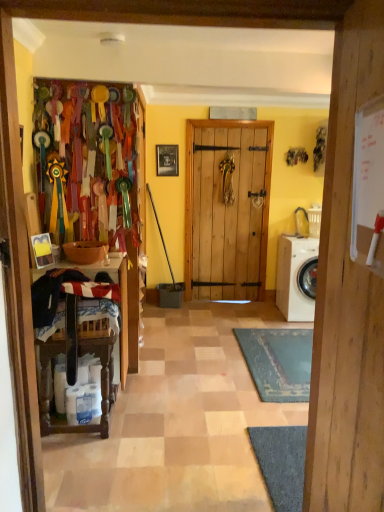
Question: From the image's perspective, would you say wooden door at center is shown under wooden frame at center?

Choices:
 (A) yes
 (B) no

Answer: (A)

Question: From a real-world perspective, is wooden door at center located higher than wooden frame at center?

Choices:
 (A) no
 (B) yes

Answer: (A)

Question: Is wooden frame at center surrounded by wooden door at center?

Choices:
 (A) no
 (B) yes

Answer: (A)

Question: From the image's perspective, is wooden door at center above wooden frame at center?

Choices:
 (A) no
 (B) yes

Answer: (A)

Question: Can you confirm if wooden door at center is wider than wooden frame at center?

Choices:
 (A) no
 (B) yes

Answer: (B)

Question: Can you confirm if wooden door at center is positioned to the left of wooden frame at center?

Choices:
 (A) yes
 (B) no

Answer: (B)

Question: From a real-world perspective, does wooden frame at center stand above wooden door at center?

Choices:
 (A) no
 (B) yes

Answer: (B)

Question: Is wooden frame at center next to wooden door at center?

Choices:
 (A) yes
 (B) no

Answer: (B)

Question: From the image's perspective, does wooden frame at center appear lower than wooden door at center?

Choices:
 (A) yes
 (B) no

Answer: (B)

Question: From a real-world perspective, does wooden frame at center sit lower than wooden door at center?

Choices:
 (A) yes
 (B) no

Answer: (B)

Question: Is wooden frame at center outside of wooden door at center?

Choices:
 (A) yes
 (B) no

Answer: (A)

Question: Does wooden frame at center have a lesser height compared to wooden door at center?

Choices:
 (A) no
 (B) yes

Answer: (B)

Question: Does wooden frame at center lie behind white matte washing machine at right?

Choices:
 (A) no
 (B) yes

Answer: (B)